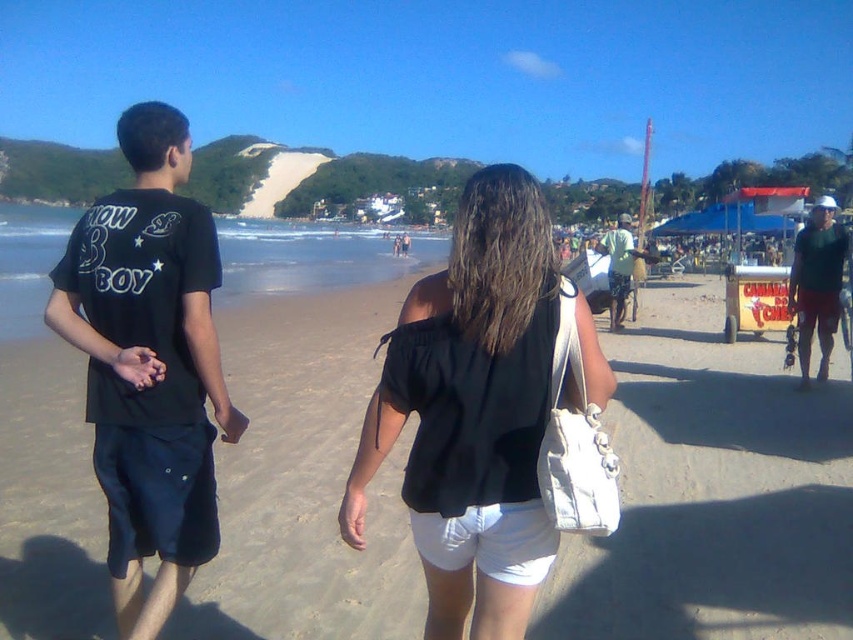
Question: Which of the following is the closest to the observer?

Choices:
 (A) (408, 244)
 (B) (834, 248)
 (C) (113, 275)

Answer: (C)

Question: Which point is closer to the camera?

Choices:
 (A) (625, 289)
 (B) (790, 420)
 (C) (395, 256)
 (D) (360, 502)

Answer: (D)

Question: Is white canvas bag at center wider than black cotton t-shirt at center?

Choices:
 (A) no
 (B) yes

Answer: (A)

Question: Can you confirm if white canvas bag at center is bigger than matte black shirt at right?

Choices:
 (A) yes
 (B) no

Answer: (B)

Question: Is white canvas bag at center to the left of black matte shirt at center from the viewer's perspective?

Choices:
 (A) yes
 (B) no

Answer: (B)

Question: Estimate the real-world distances between objects in this image. Which object is closer to the white fabric bag at center?

Choices:
 (A) green fabric shirt at center
 (B) matte black shirt at right

Answer: (B)